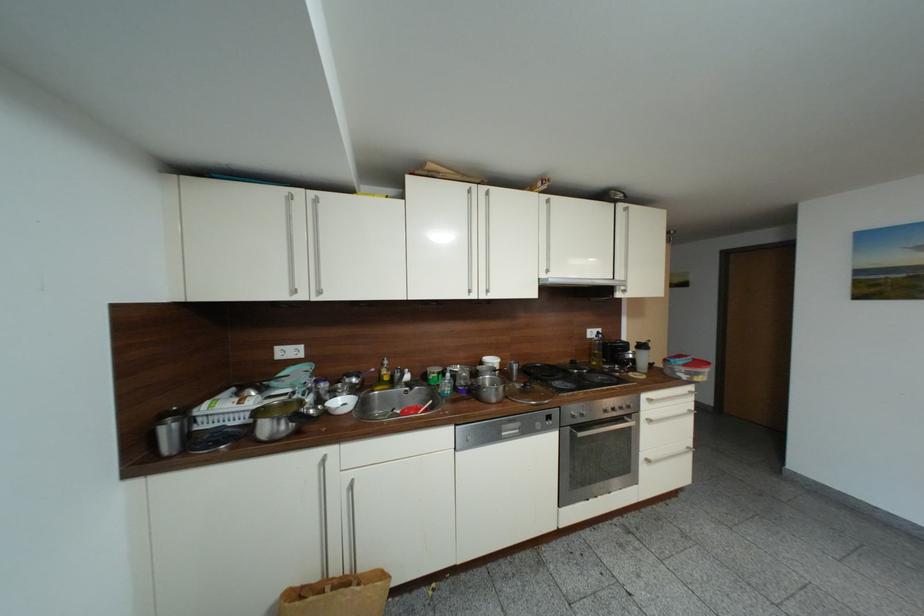
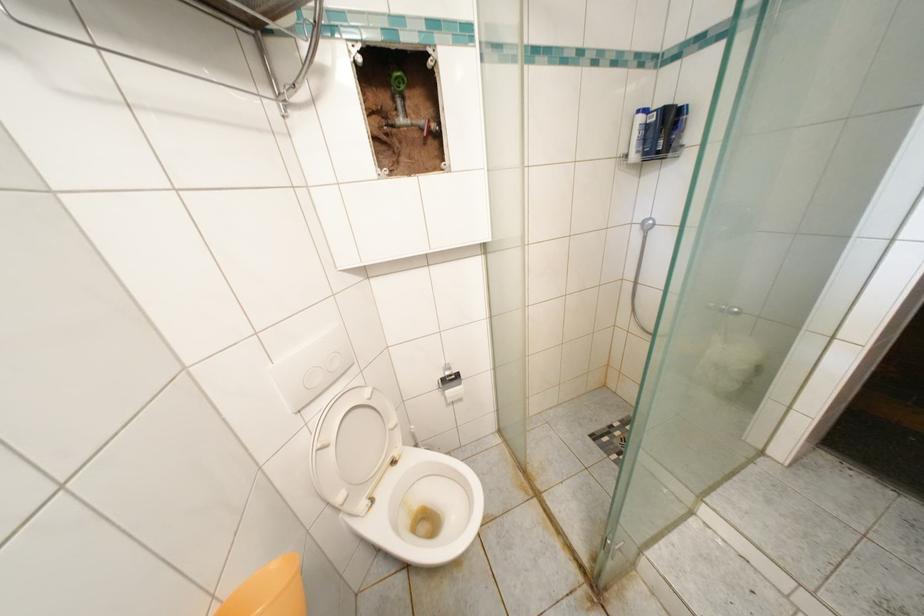
What movement of the cameraman would produce the second image?

The movement direction of the cameraman is left, forward.